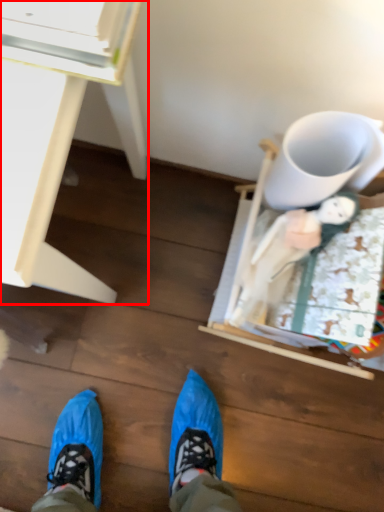
Question: From the image's perspective, considering the relative positions of desk (annotated by the red box) and mug in the image provided, where is desk (annotated by the red box) located with respect to the staircase?

Choices:
 (A) below
 (B) above

Answer: (A)